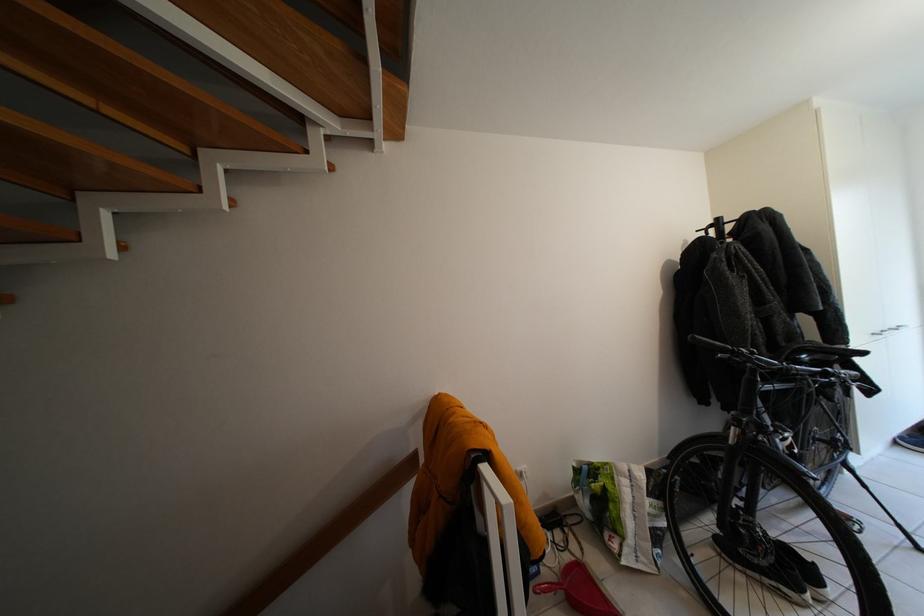
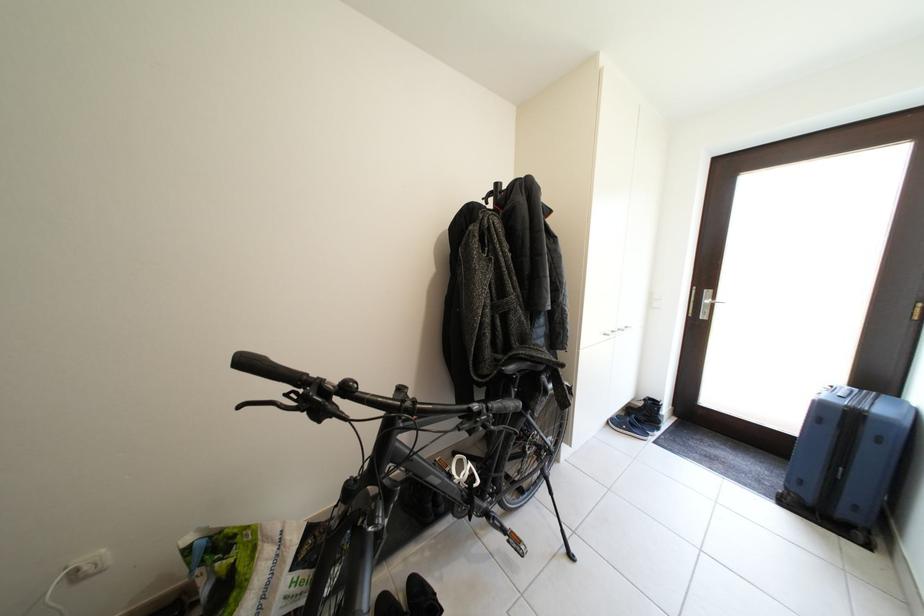
What movement of the cameraman would produce the second image?

The movement direction of the cameraman is right, forward.